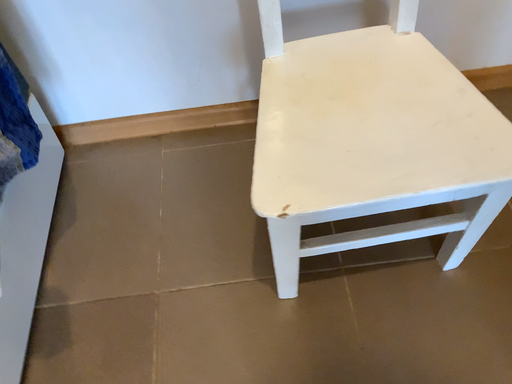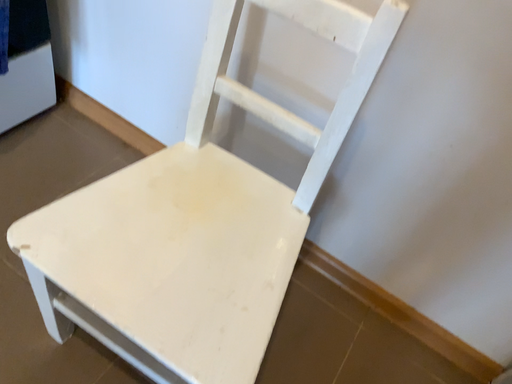
Question: How did the camera likely rotate when shooting the video?

Choices:
 (A) rotated upward
 (B) rotated downward

Answer: (A)